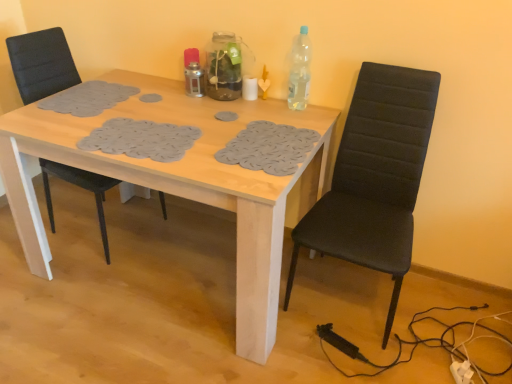
Find the location of a particular element. The image size is (512, 384). free space in front of clear plastic bottle at upper right is located at coordinates coord(302,119).